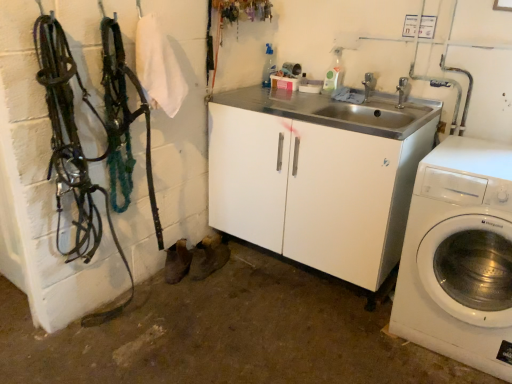
Describe the element at coordinates (369, 85) in the screenshot. I see `silver metallic faucet at upper center, positioned as the 1th faucet in back-to-front order` at that location.

You are a GUI agent. You are given a task and a screenshot of the screen. Output one action in this format:
    pyautogui.click(x=<x>, y=<y>)
    Task: Click on the silver metallic faucet at upper center, the 2th faucet from the front
    
    Given the screenshot: What is the action you would take?
    (369, 85)

Image resolution: width=512 pixels, height=384 pixels. What do you see at coordinates (458, 256) in the screenshot?
I see `white plastic washing machine at right` at bounding box center [458, 256].

This screenshot has width=512, height=384. What do you see at coordinates (402, 92) in the screenshot? I see `silver metallic faucet at upper center, the 1th faucet when ordered from right to left` at bounding box center [402, 92].

Where is `silver metallic faucet at upper center, which is counted as the 1th faucet, starting from the left`? silver metallic faucet at upper center, which is counted as the 1th faucet, starting from the left is located at coordinates (369, 85).

Which object is thinner, silver metallic faucet at upper center, the 2th faucet from the front, or silver metallic faucet at upper center, the 1th faucet when ordered from right to left?

silver metallic faucet at upper center, the 1th faucet when ordered from right to left, is thinner.

From a real-world perspective, is silver metallic faucet at upper center, the 2th faucet from the front, physically located above or below silver metallic faucet at upper center, acting as the second faucet starting from the left?

Clearly, from a real-world perspective, silver metallic faucet at upper center, the 2th faucet from the front, is above silver metallic faucet at upper center, acting as the second faucet starting from the left.

You are a GUI agent. You are given a task and a screenshot of the screen. Output one action in this format:
    pyautogui.click(x=<x>, y=<y>)
    Task: Click on the faucet beneath the silver metallic faucet at upper center, which is counted as the 1th faucet, starting from the left (from a real-world perspective)
    
    Given the screenshot: What is the action you would take?
    pyautogui.click(x=402, y=92)

Considering the positions of objects silver metallic faucet at upper center, which is counted as the 1th faucet, starting from the left, and silver metallic faucet at upper center, the second faucet in the back-to-front sequence, in the image provided, who is more to the right, silver metallic faucet at upper center, which is counted as the 1th faucet, starting from the left, or silver metallic faucet at upper center, the second faucet in the back-to-front sequence,?

silver metallic faucet at upper center, the second faucet in the back-to-front sequence.

Considering the relative positions of silver metallic faucet at upper center, acting as the second faucet starting from the left, and white plastic washing machine at right in the image provided, is silver metallic faucet at upper center, acting as the second faucet starting from the left, to the left of white plastic washing machine at right from the viewer's perspective?

Correct, you'll find silver metallic faucet at upper center, acting as the second faucet starting from the left, to the left of white plastic washing machine at right.

Does silver metallic faucet at upper center, the 1th faucet when ordered from right to left, turn towards white plastic washing machine at right?

No, silver metallic faucet at upper center, the 1th faucet when ordered from right to left, does not turn towards white plastic washing machine at right.

Considering their positions, is silver metallic faucet at upper center, acting as the second faucet starting from the left, located in front of or behind white plastic washing machine at right?

Visually, silver metallic faucet at upper center, acting as the second faucet starting from the left, is located behind white plastic washing machine at right.

Which of these two, silver metallic faucet at upper center, the 1th faucet when ordered from right to left, or white plastic washing machine at right, is wider?

With larger width is white plastic washing machine at right.

From a real-world perspective, who is located higher, silver metallic faucet at upper center, the 2th faucet from the front, or white plastic washing machine at right?

silver metallic faucet at upper center, the 2th faucet from the front.

Is silver metallic faucet at upper center, the 2th faucet from the front, at the left side of white plastic washing machine at right?

Yes.

Is silver metallic faucet at upper center, positioned as the 1th faucet in back-to-front order, in front of white plastic washing machine at right?

No, the depth of silver metallic faucet at upper center, positioned as the 1th faucet in back-to-front order, is greater than that of white plastic washing machine at right.

In the scene shown: Between silver metallic faucet at upper center, positioned as the 1th faucet in back-to-front order, and white plastic washing machine at right, which one has less height?

With less height is silver metallic faucet at upper center, positioned as the 1th faucet in back-to-front order.

Does white plastic washing machine at right touch silver metallic faucet at upper center, acting as the first faucet starting from the front?

No.

From a real-world perspective, is white plastic washing machine at right physically below silver metallic faucet at upper center, acting as the second faucet starting from the left?

Yes, from a real-world perspective, white plastic washing machine at right is under silver metallic faucet at upper center, acting as the second faucet starting from the left.

Which of these two, white plastic washing machine at right or silver metallic faucet at upper center, the 1th faucet when ordered from right to left, stands taller?

white plastic washing machine at right.

From a real-world perspective, which object stands above the other?

silver metallic faucet at upper center, positioned as the 1th faucet in back-to-front order.

Is silver metallic faucet at upper center, the second faucet in the back-to-front sequence, at the right side of silver metallic faucet at upper center, which is counted as the 1th faucet, starting from the left?

Yes, silver metallic faucet at upper center, the second faucet in the back-to-front sequence, is to the right of silver metallic faucet at upper center, which is counted as the 1th faucet, starting from the left.

Based on the photo, is silver metallic faucet at upper center, the 2th faucet from the front, a part of silver metallic faucet at upper center, the second faucet in the back-to-front sequence?

No.

Consider the image. Based on their sizes in the image, would you say white plastic washing machine at right is bigger or smaller than silver metallic faucet at upper center, positioned as the 2th faucet in right-to-left order?

Considering their sizes, white plastic washing machine at right takes up more space than silver metallic faucet at upper center, positioned as the 2th faucet in right-to-left order.

Measure the distance from white plastic washing machine at right to silver metallic faucet at upper center, positioned as the 1th faucet in back-to-front order.

white plastic washing machine at right and silver metallic faucet at upper center, positioned as the 1th faucet in back-to-front order, are 97.76 centimeters apart.

Can you confirm if white plastic washing machine at right is wider than silver metallic faucet at upper center, positioned as the 1th faucet in back-to-front order?

Indeed, white plastic washing machine at right has a greater width compared to silver metallic faucet at upper center, positioned as the 1th faucet in back-to-front order.

From a real-world perspective, which object rests below the other?

In real-world perspective, white plastic washing machine at right is lower.

Where is `faucet that appears above the silver metallic faucet at upper center, the 1th faucet when ordered from right to left (from a real-world perspective)`? The height and width of the screenshot is (384, 512). faucet that appears above the silver metallic faucet at upper center, the 1th faucet when ordered from right to left (from a real-world perspective) is located at coordinates (369, 85).

At what (x,y) coordinates should I click in order to perform the action: click on washing machine in front of the silver metallic faucet at upper center, acting as the second faucet starting from the left. Please return your answer as a coordinate pair (x, y). This screenshot has width=512, height=384. Looking at the image, I should click on coord(458,256).

Estimate the real-world distances between objects in this image. Which object is closer to silver metallic faucet at upper center, the second faucet in the back-to-front sequence, silver metallic faucet at upper center, the 2th faucet from the front, or white plastic washing machine at right?

The object closer to silver metallic faucet at upper center, the second faucet in the back-to-front sequence, is silver metallic faucet at upper center, the 2th faucet from the front.

From the image, which object appears to be farther from silver metallic faucet at upper center, the second faucet in the back-to-front sequence, white plastic washing machine at right or silver metallic faucet at upper center, the 2th faucet from the front?

white plastic washing machine at right is positioned further to the anchor silver metallic faucet at upper center, the second faucet in the back-to-front sequence.

When comparing their distances from white plastic washing machine at right, does silver metallic faucet at upper center, acting as the first faucet starting from the front, or silver metallic faucet at upper center, which is counted as the 1th faucet, starting from the left, seem further?

Based on the image, silver metallic faucet at upper center, which is counted as the 1th faucet, starting from the left, appears to be further to white plastic washing machine at right.

In the scene shown: When comparing their distances from white plastic washing machine at right, does silver metallic faucet at upper center, which is counted as the 1th faucet, starting from the left, or silver metallic faucet at upper center, the 1th faucet when ordered from right to left, seem closer?

silver metallic faucet at upper center, the 1th faucet when ordered from right to left.

When comparing their distances from silver metallic faucet at upper center, positioned as the 2th faucet in right-to-left order, does white plastic washing machine at right or silver metallic faucet at upper center, acting as the second faucet starting from the left, seem closer?

The object closer to silver metallic faucet at upper center, positioned as the 2th faucet in right-to-left order, is silver metallic faucet at upper center, acting as the second faucet starting from the left.

Consider the image. Considering their positions, is silver metallic faucet at upper center, acting as the second faucet starting from the left, positioned further to silver metallic faucet at upper center, positioned as the 2th faucet in right-to-left order, than white plastic washing machine at right?

white plastic washing machine at right is positioned further to the anchor silver metallic faucet at upper center, positioned as the 2th faucet in right-to-left order.

Find the location of a particular element. faucet between white plastic washing machine at right and silver metallic faucet at upper center, positioned as the 1th faucet in back-to-front order, from front to back is located at coordinates (402, 92).